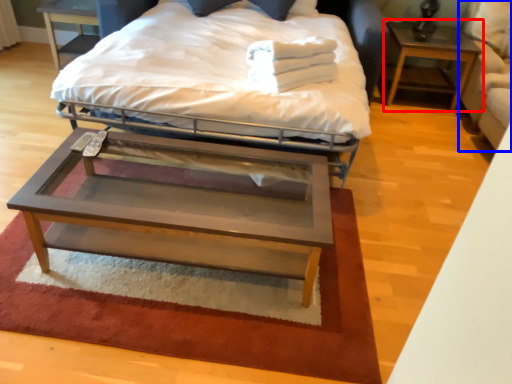
Question: Which point is closer to the camera, nightstand (highlighted by a red box) or swivel chair (highlighted by a blue box)?

Choices:
 (A) nightstand
 (B) swivel chair

Answer: (B)